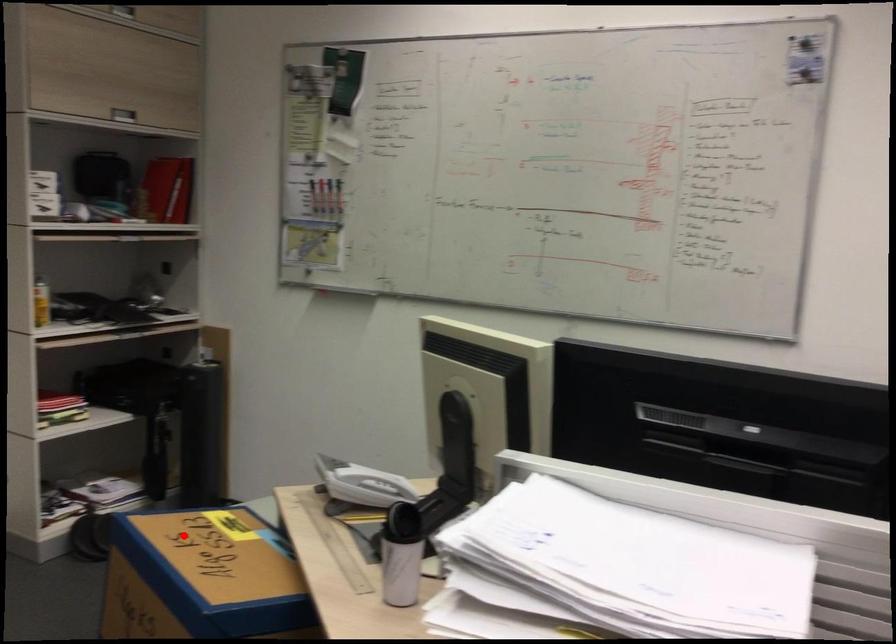
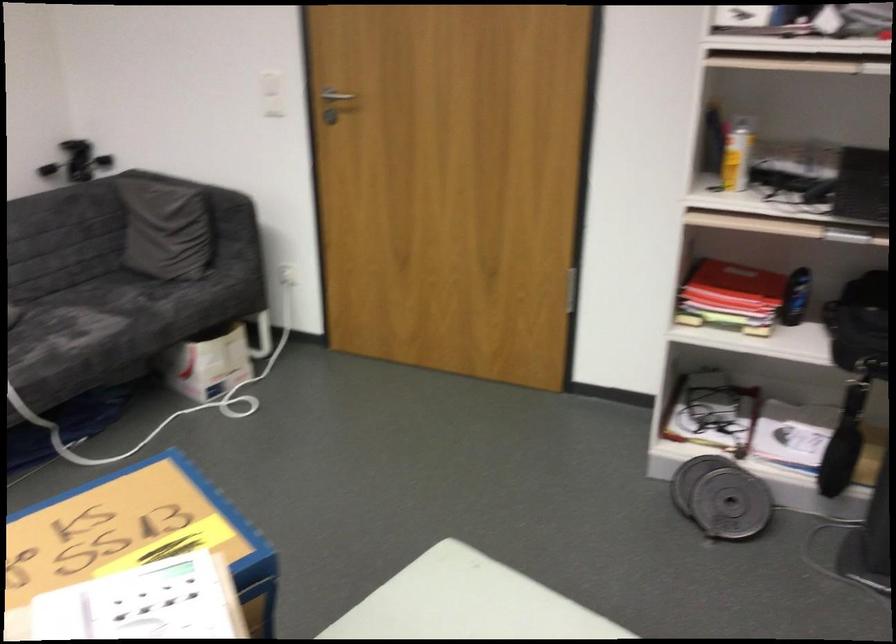
Question: I am providing you with two images of the same scene from different viewpoints. A red point is shown in image1. For the corresponding object point in image2, is it positioned nearer or farther from the camera?

Choices:
 (A) Nearer
 (B) Farther

Answer: (A)